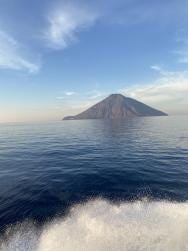
Where is `island top`? The height and width of the screenshot is (251, 188). island top is located at coordinates tap(116, 93).